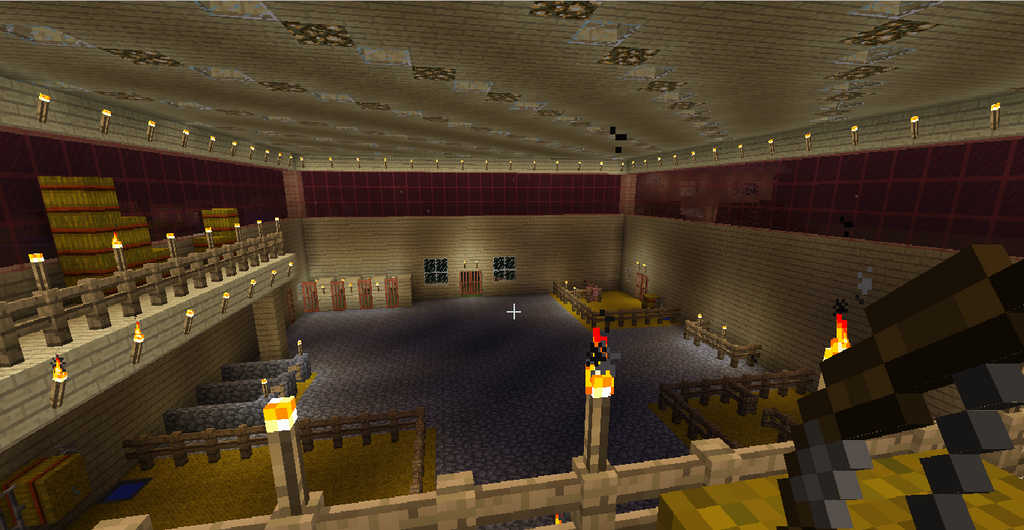
I want to click on doors, so click(x=468, y=289).